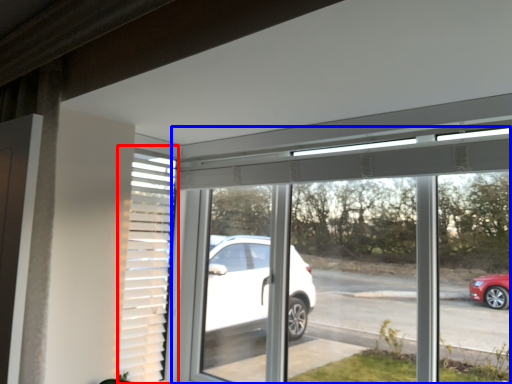
Question: Among these objects, which one is nearest to the camera, shutter (highlighted by a red box) or window (highlighted by a blue box)?

Choices:
 (A) shutter
 (B) window

Answer: (B)